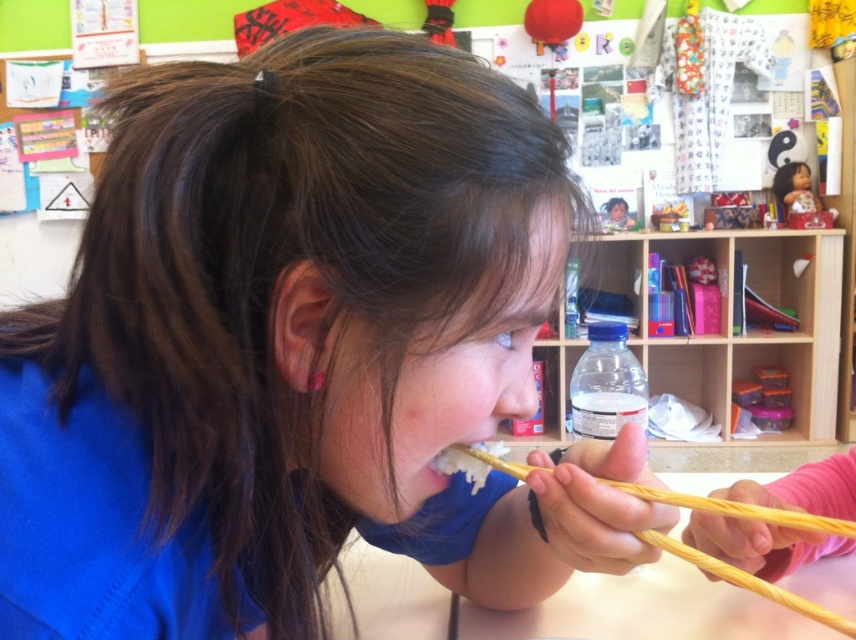
Question: Is the position of smooth porcelain doll at upper right less distant than that of smooth skin face at upper center?

Choices:
 (A) yes
 (B) no

Answer: (A)

Question: In this image, where is smooth skin face at center located relative to smooth porcelain doll at upper right?

Choices:
 (A) right
 (B) left

Answer: (B)

Question: Among these objects, which one is nearest to the camera?

Choices:
 (A) wooden chopsticks at lower center
 (B) smooth skin face at center

Answer: (B)

Question: Is smooth skin face at center below smooth skin face at upper center?

Choices:
 (A) yes
 (B) no

Answer: (A)

Question: Which point is closer to the camera taking this photo?

Choices:
 (A) (810, 182)
 (B) (485, 308)
 (C) (789, 180)

Answer: (B)

Question: Which object appears farthest from the camera in this image?

Choices:
 (A) smooth skin face at upper center
 (B) wooden chopsticks at lower center
 (C) smooth porcelain doll at upper right
 (D) smooth skin face at center

Answer: (A)